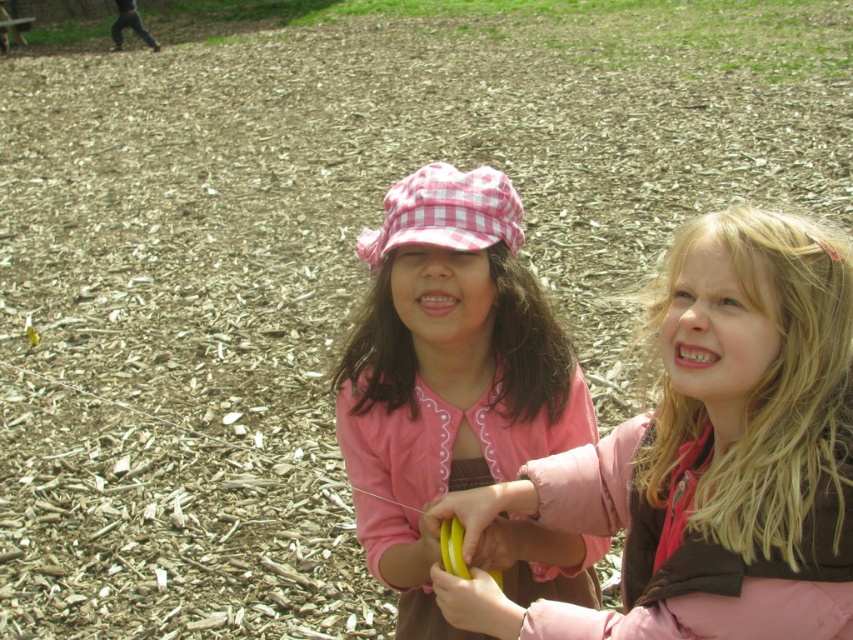
Is pink fabric jacket at center further to the viewer compared to pink gingham hat at center?

No.

Who is more distant from viewer, (x=749, y=404) or (x=465, y=406)?

Positioned behind is point (x=465, y=406).

Is point (813, 339) farther from viewer compared to point (390, 332)?

No, (813, 339) is closer to viewer.

You are a GUI agent. You are given a task and a screenshot of the screen. Output one action in this format:
    pyautogui.click(x=<x>, y=<y>)
    Task: Click on the pink fabric jacket at center
    This screenshot has width=853, height=640.
    Given the screenshot: What is the action you would take?
    pyautogui.click(x=708, y=456)

Between pink fabric jacket at center and yellow rubber banana at center, which one has more height?

With more height is pink fabric jacket at center.

Who is lower down, pink fabric jacket at center or yellow rubber banana at center?

yellow rubber banana at center is below.

Describe the element at coordinates (708, 456) in the screenshot. I see `pink fabric jacket at center` at that location.

At what (x,y) coordinates should I click in order to perform the action: click on pink fabric jacket at center. Please return your answer as a coordinate pair (x, y). Looking at the image, I should click on (708, 456).

Which is more to the left, pink gingham hat at center or yellow rubber banana at center?

Positioned to the left is pink gingham hat at center.

Which is more to the right, pink gingham hat at center or yellow rubber banana at center?

yellow rubber banana at center

Which is in front, point (405, 620) or point (445, 554)?

Point (445, 554)

Locate an element on the screen. The width and height of the screenshot is (853, 640). pink gingham hat at center is located at coordinates (445, 372).